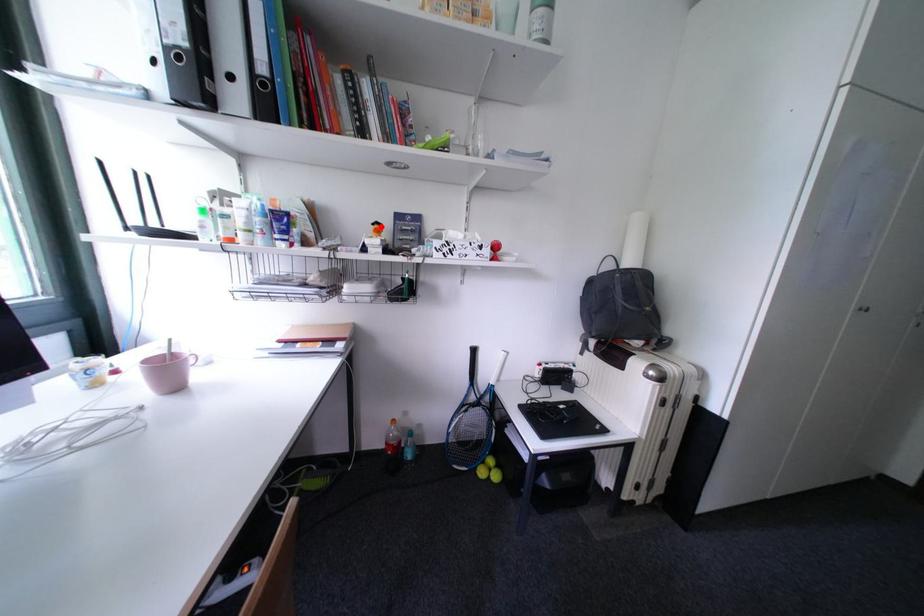
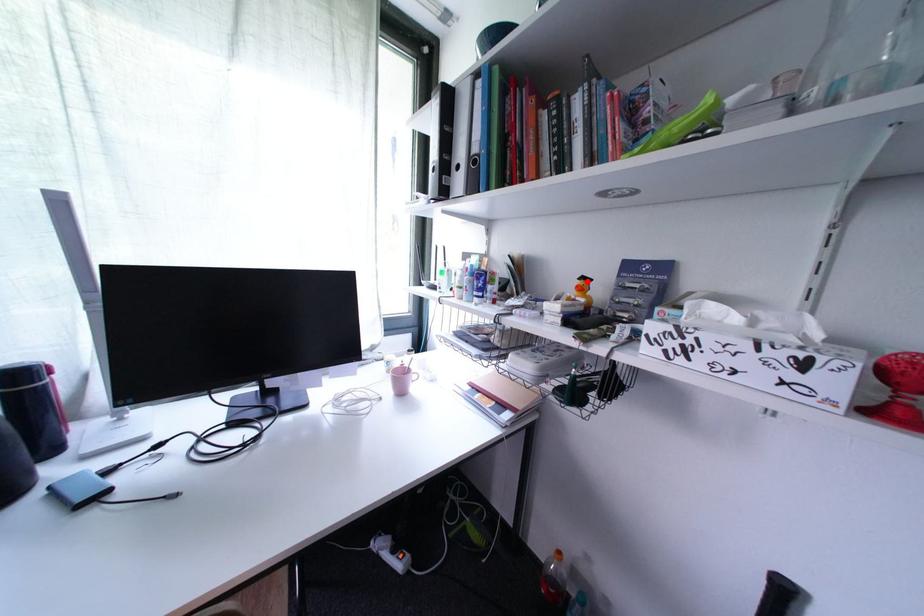
I am providing you with two images of the same scene from different viewpoints. A red point is marked on the first image and another point is marked on the second image. Is the red point in image1 aligned with the point shown in image2?

Yes